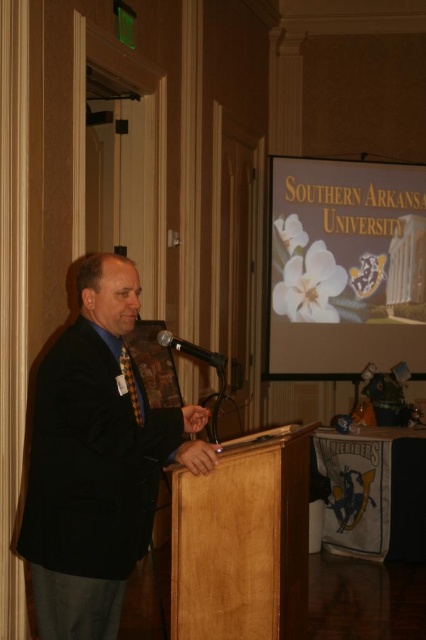
You are an event planner who wants to place a decorative item on the podium. The podium has a coordinate system where the bottom left corner is the origin point. The white matte flower at upper center is already placed at point (345, 268). If you want to place a new item 2 inches to the right of the white matte flower at upper center, what would be the new coordinate point?

The new coordinate point would be 0.419 plus 2 inches divided by the podium width in inches, but since the coordinate system is normalized between 0 and 1, we need to know the actual dimensions of the podium to calculate the exact coordinate. Without that information, we can only state that the new point would be to the right of (345, 268) by 2 inches in real measurement.

You are attending a conference and need to reach the white matte flower at upper center on the podium. Considering the distance between you and the flower, can you safely walk forward to grab it without overstepping the podium area?

The distance between you and the white matte flower at upper center is 19.82 feet. Since this distance is quite large, walking forward to grab it would require moving well beyond the podium area, so it is not advisable to attempt this.

You are sitting in the audience and want to see both the black textured suit at center and the wooden podium at center clearly. Which object will appear larger to you?

The black textured suit at center will appear larger because it is closer to the viewer than the wooden podium at center.